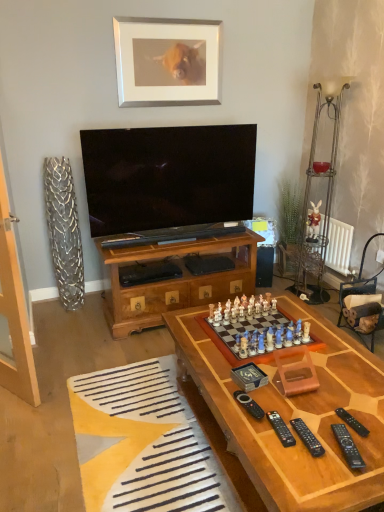
Where is `vacant area that is in front of black plastic remote at center, which appears as the first remote when viewed from the left`? The image size is (384, 512). vacant area that is in front of black plastic remote at center, which appears as the first remote when viewed from the left is located at coordinates (260, 439).